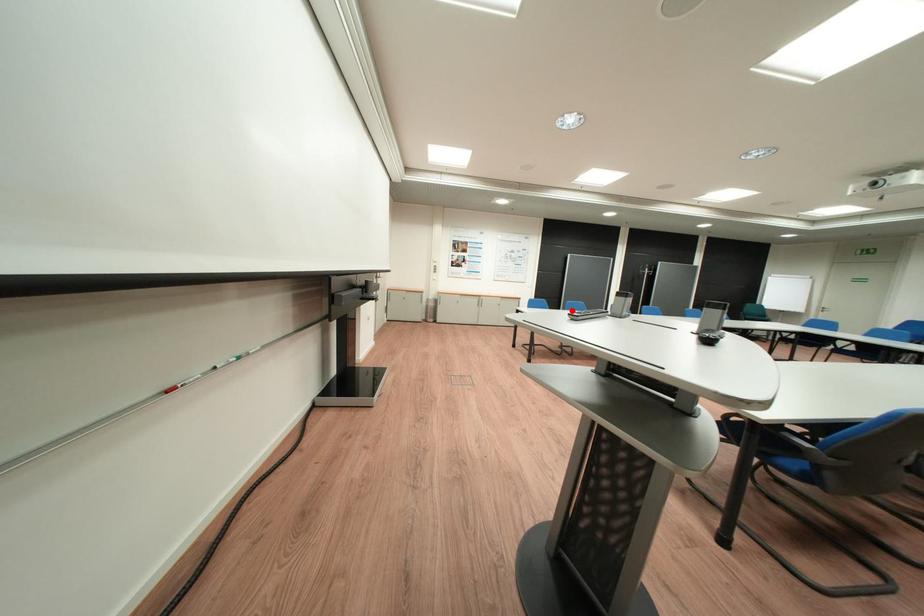
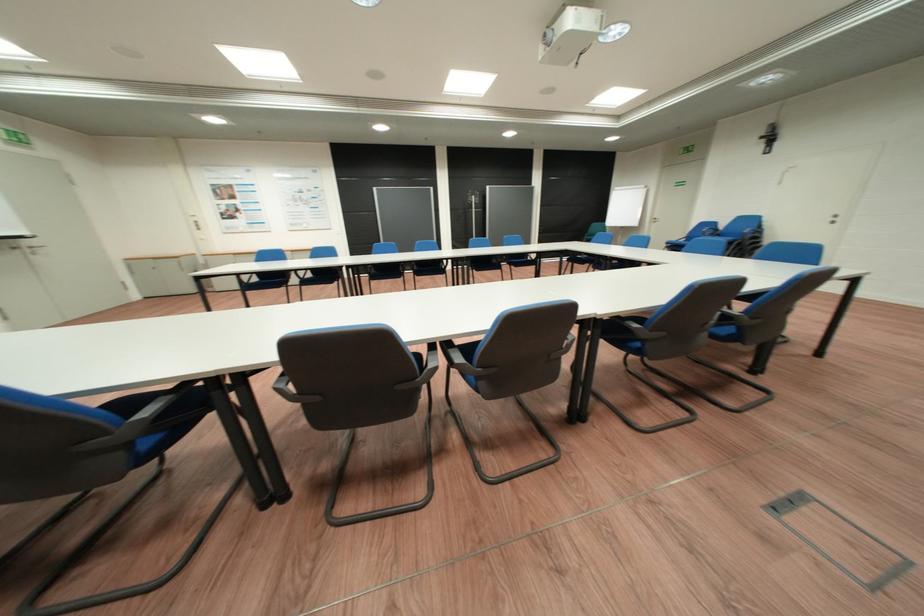
Question: I am providing you with two images of the same scene from different viewpoints. A red point is marked on the first image. Is the red point's position out of view in image 2?

Choices:
 (A) Yes
 (B) No

Answer: (A)